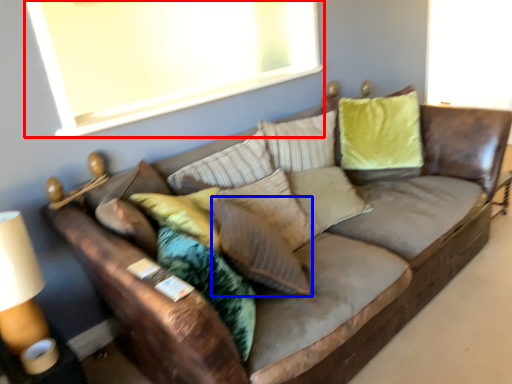
Question: Among these objects, which one is nearest to the camera, window screen (highlighted by a red box) or pillow (highlighted by a blue box)?

Choices:
 (A) window screen
 (B) pillow

Answer: (B)